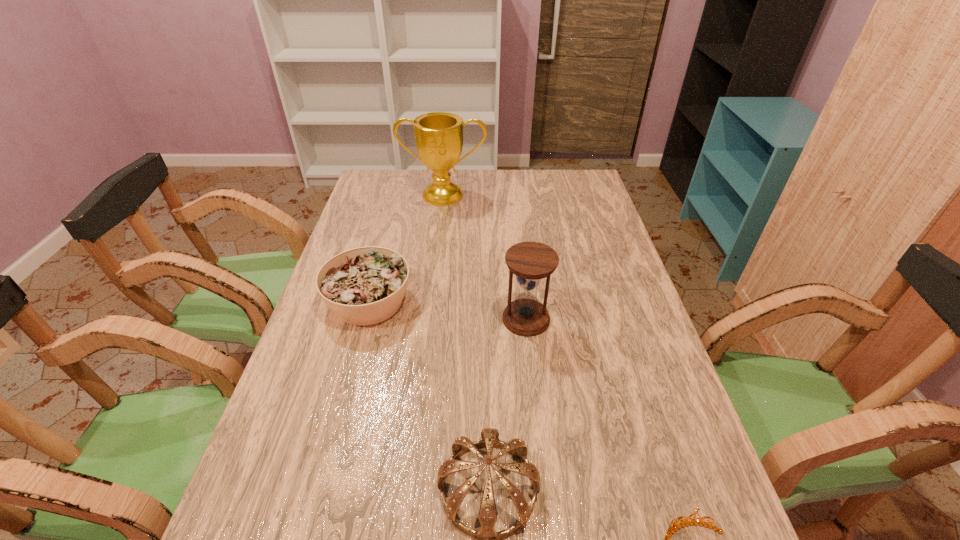
Identify the location of award. (438, 135).

This screenshot has height=540, width=960. Find the location of `the tallest object`. the tallest object is located at coordinates (438, 135).

The image size is (960, 540). I want to click on the second tallest object, so click(x=530, y=261).

The height and width of the screenshot is (540, 960). Find the location of `salad`. salad is located at coordinates (x=364, y=286).

Where is `vacant space situated on the shiny surface of the farthest object`? The image size is (960, 540). vacant space situated on the shiny surface of the farthest object is located at coordinates (439, 237).

Locate an element on the screen. free location located on the back of the hourglass is located at coordinates (523, 287).

Locate an element on the screen. This screenshot has height=540, width=960. vacant space located 0.400m on the back of the salad is located at coordinates (396, 202).

The height and width of the screenshot is (540, 960). I want to click on object that is at the far edge, so click(x=438, y=135).

Find the location of a particular element. award located in the left edge section of the desktop is located at coordinates (438, 135).

Image resolution: width=960 pixels, height=540 pixels. In order to click on salad positioned at the left edge in this screenshot , I will do `click(364, 286)`.